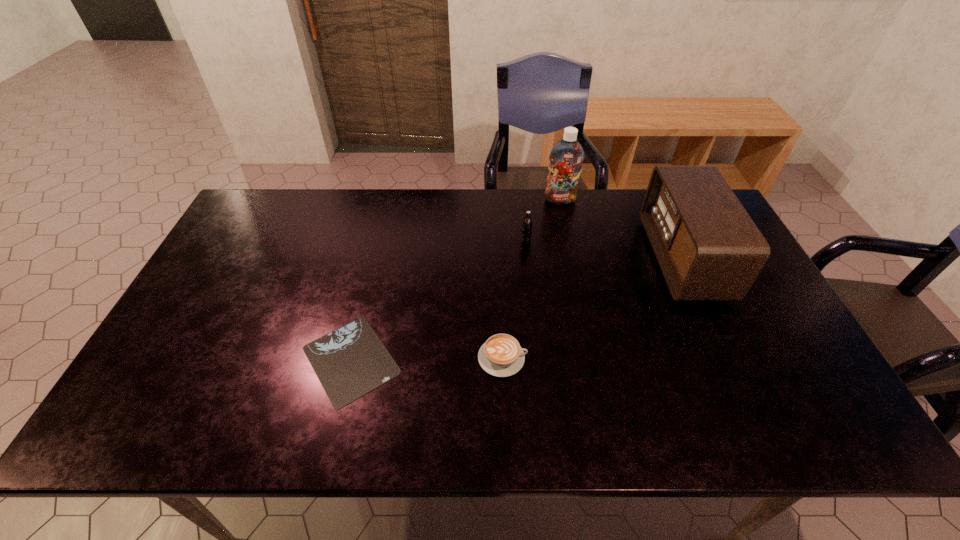
Identify the location of free spot located 0.380m on the front label of the shampoo. (578, 285).

You are a GUI agent. You are given a task and a screenshot of the screen. Output one action in this format:
    pyautogui.click(x=<x>, y=<y>)
    Task: Click on the free region located 0.280m on the front-facing side of the rightmost object
    
    Given the screenshot: What is the action you would take?
    pyautogui.click(x=562, y=259)

Where is `free spot located 0.380m on the front-facing side of the rightmost object`? free spot located 0.380m on the front-facing side of the rightmost object is located at coordinates (529, 259).

Locate an element on the screen. The height and width of the screenshot is (540, 960). free space located on the front-facing side of the rightmost object is located at coordinates (529, 259).

What are the coordinates of `blank space located 0.120m on the front label of the pop` in the screenshot? It's located at (529, 271).

In order to click on vacant point located 0.150m on the side of the second object from left to right with the handle in this screenshot , I will do `click(588, 358)`.

Find the location of `free space located 0.270m on the back of the mousepad`. free space located 0.270m on the back of the mousepad is located at coordinates (377, 250).

Identify the location of shampoo located at the far edge. (566, 157).

Locate an element on the screen. The image size is (960, 540). radio receiver situated at the far edge is located at coordinates (708, 247).

The height and width of the screenshot is (540, 960). Find the location of `object that is at the near edge`. object that is at the near edge is located at coordinates (351, 361).